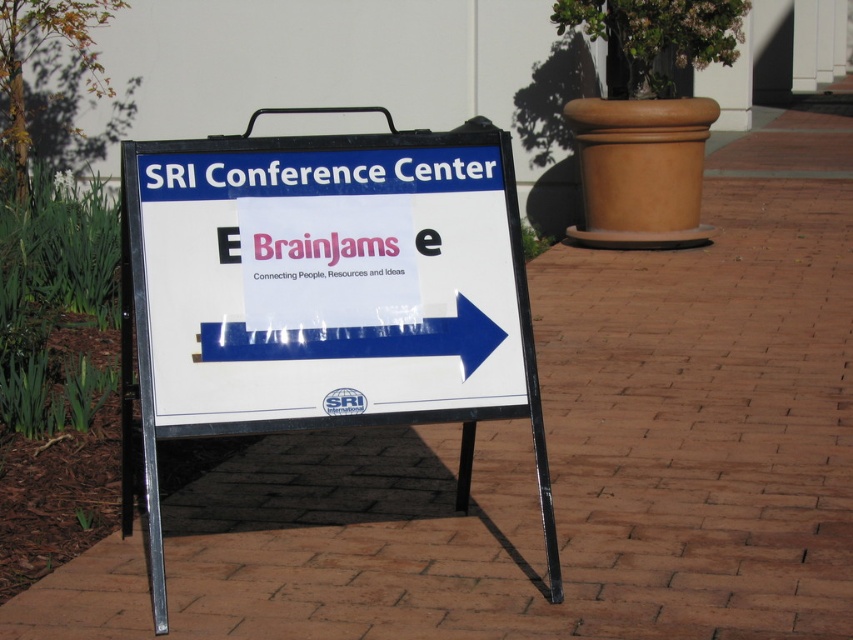
Question: Which point is farther to the camera?

Choices:
 (A) white plastic sign at center
 (B) blue glossy arrow at center

Answer: (B)

Question: Among these points, which one is nearest to the camera?

Choices:
 (A) (190, 209)
 (B) (286, 355)

Answer: (B)

Question: Can you confirm if white plastic sign at center is positioned to the right of blue glossy arrow at center?

Choices:
 (A) yes
 (B) no

Answer: (B)

Question: Is white plastic sign at center thinner than blue glossy arrow at center?

Choices:
 (A) no
 (B) yes

Answer: (A)

Question: In this image, where is white plastic sign at center located relative to blue glossy arrow at center?

Choices:
 (A) right
 (B) left

Answer: (B)